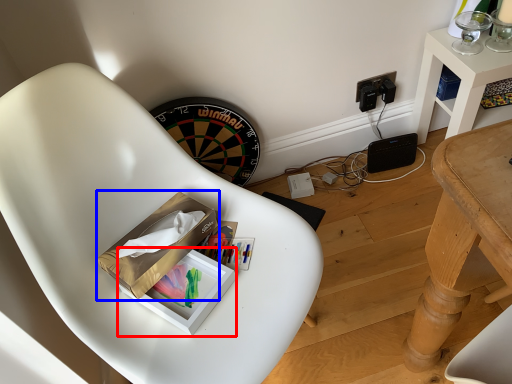
Question: Which point is further to the camera, box (highlighted by a red box) or cardboard box (highlighted by a blue box)?

Choices:
 (A) box
 (B) cardboard box

Answer: (A)